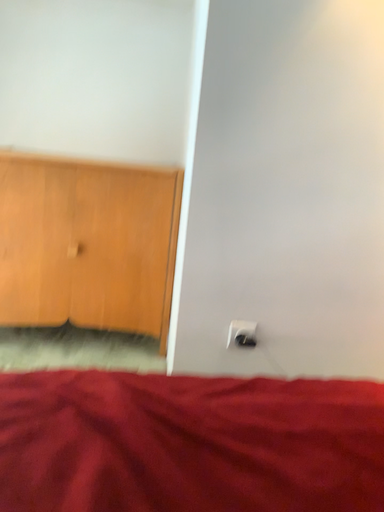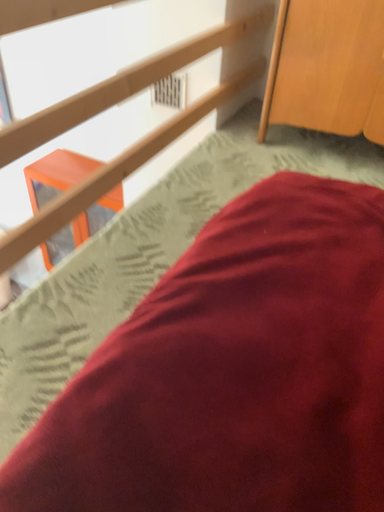
Question: Which way did the camera rotate in the video?

Choices:
 (A) rotated downward
 (B) rotated upward

Answer: (A)